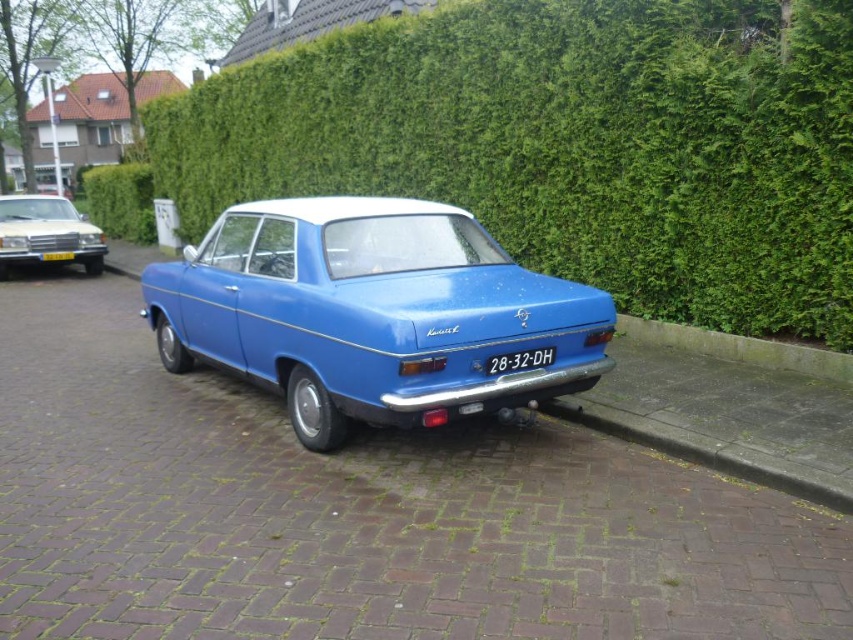
Does green leafy hedge at upper center have a greater width compared to white plastic license plate at center?

Yes.

Consider the image. Who is more distant from viewer, [432,45] or [543,353]?

Positioned behind is point [432,45].

Where is `green leafy hedge at upper center`? green leafy hedge at upper center is located at coordinates (567, 145).

Between point (798, 96) and point (254, 312), which one is positioned in front?

Point (254, 312)

What do you see at coordinates (567, 145) in the screenshot?
I see `green leafy hedge at upper center` at bounding box center [567, 145].

Is point (749, 42) farther from camera compared to point (360, 250)?

Yes, it is behind point (360, 250).

I want to click on green leafy hedge at upper center, so click(x=567, y=145).

In the scene shown: Does white plastic license plate at center appear on the right side of yellow plastic license plate at center?

Yes, white plastic license plate at center is to the right of yellow plastic license plate at center.

What do you see at coordinates (519, 360) in the screenshot? I see `white plastic license plate at center` at bounding box center [519, 360].

Measure the distance between point (538, 365) and camera.

4.86 meters

Where is `white plastic license plate at center`? The image size is (853, 640). white plastic license plate at center is located at coordinates (519, 360).